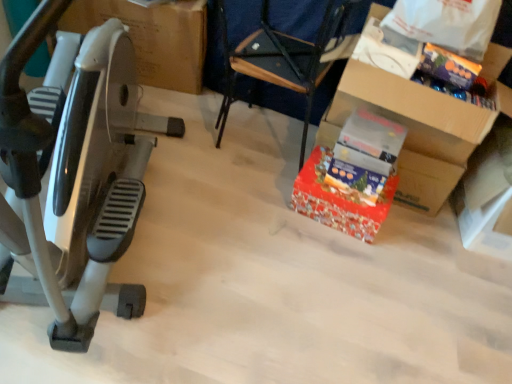
I want to click on free space that is to the left of red glossy gift at center, positioned as the 1th gift in bottom-to-top order, so click(268, 197).